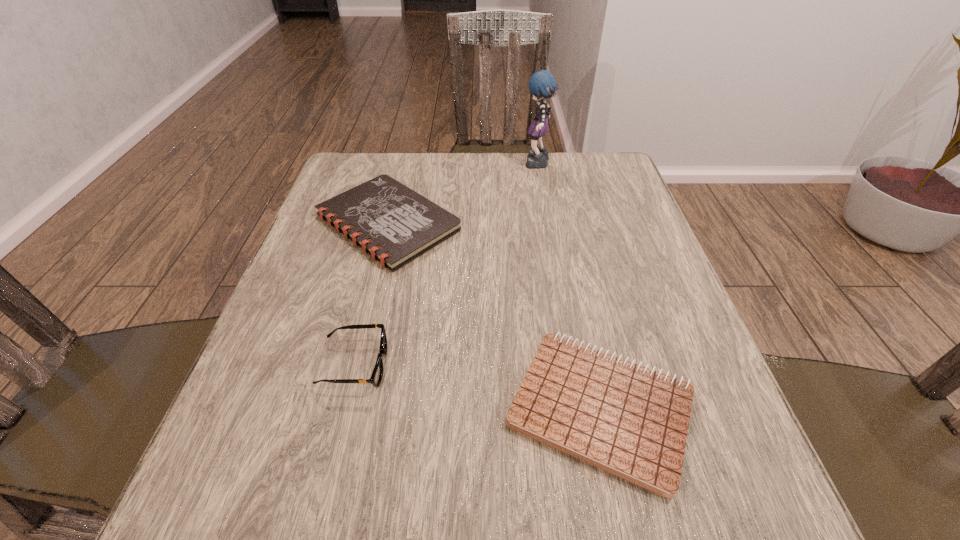
Where is `free spot that satisfies the following two spatial constraints: 1. on the back side of the nearer notebook; 2. on the front-facing side of the tallest object`? The width and height of the screenshot is (960, 540). free spot that satisfies the following two spatial constraints: 1. on the back side of the nearer notebook; 2. on the front-facing side of the tallest object is located at coordinates (548, 165).

Locate an element on the screen. The image size is (960, 540). vacant space that satisfies the following two spatial constraints: 1. on the front side of the farther notebook; 2. on the right side of the shortest object is located at coordinates (342, 408).

What are the coordinates of `vacant region that satisfies the following two spatial constraints: 1. on the front-facing side of the rag doll; 2. on the left side of the shorter notebook` in the screenshot? It's located at (582, 408).

Locate an element on the screen. Image resolution: width=960 pixels, height=540 pixels. free space that satisfies the following two spatial constraints: 1. on the front side of the left notebook; 2. on the right side of the shorter notebook is located at coordinates (342, 408).

Locate an element on the screen. The height and width of the screenshot is (540, 960). vacant point that satisfies the following two spatial constraints: 1. on the front-facing side of the third shortest object; 2. on the left side of the shorter notebook is located at coordinates (345, 408).

This screenshot has height=540, width=960. I want to click on free spot that satisfies the following two spatial constraints: 1. on the front-facing side of the shorter notebook; 2. on the left side of the sunglasses, so click(345, 408).

The width and height of the screenshot is (960, 540). What are the coordinates of `blank area in the image that satisfies the following two spatial constraints: 1. on the front-facing side of the rag doll; 2. on the left side of the shortest object` in the screenshot? It's located at (582, 408).